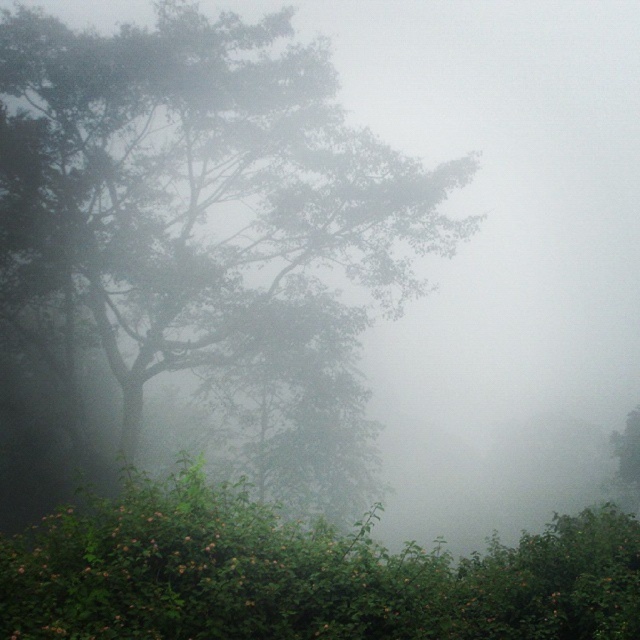
In the misty forest scene, you see a green leafy tree at left and a green leafy bush at lower center. Which object is bigger in size?

The green leafy tree at left is larger in size than the green leafy bush at lower center.